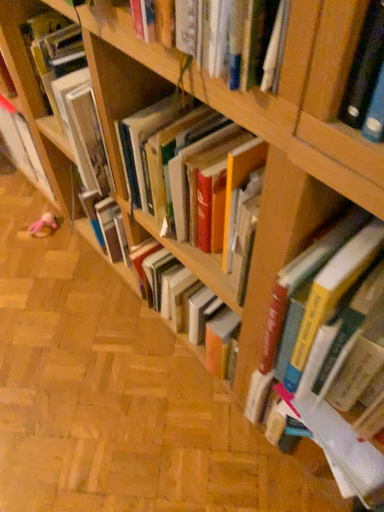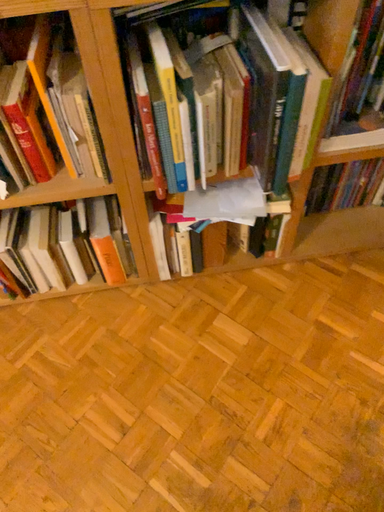
Question: Which way did the camera rotate in the video?

Choices:
 (A) rotated right
 (B) rotated left

Answer: (A)